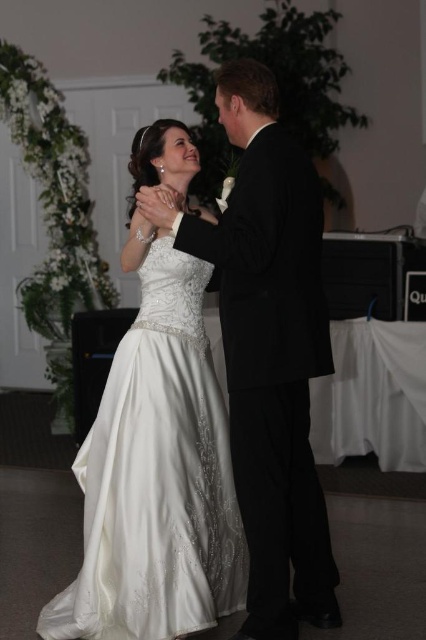
Question: Which point is closer to the camera?

Choices:
 (A) satin dress at center
 (B) shiny black suit at center

Answer: (B)

Question: Is satin dress at center above shiny black suit at center?

Choices:
 (A) yes
 (B) no

Answer: (B)

Question: Which of the following is the closest to the observer?

Choices:
 (A) (239, 288)
 (B) (94, 592)

Answer: (A)

Question: In this image, where is satin dress at center located relative to shiny black suit at center?

Choices:
 (A) right
 (B) left

Answer: (B)

Question: Is satin dress at center further to camera compared to shiny black suit at center?

Choices:
 (A) no
 (B) yes

Answer: (B)